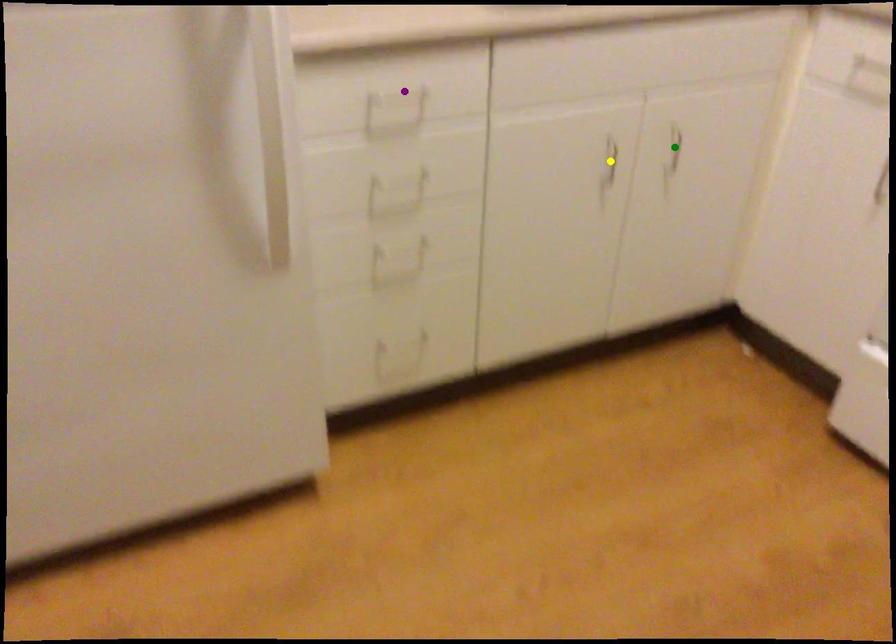
Order these from farthest to nearest:
A) purple point
B) yellow point
C) green point

green point → yellow point → purple point